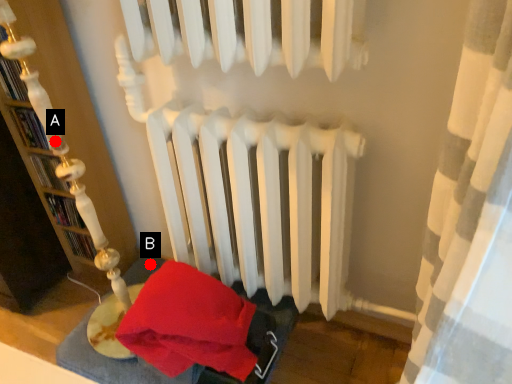
Question: Two points are circled on the image, labeled by A and B beside each circle. Which point is further to the camera?

Choices:
 (A) A is further
 (B) B is further

Answer: (B)